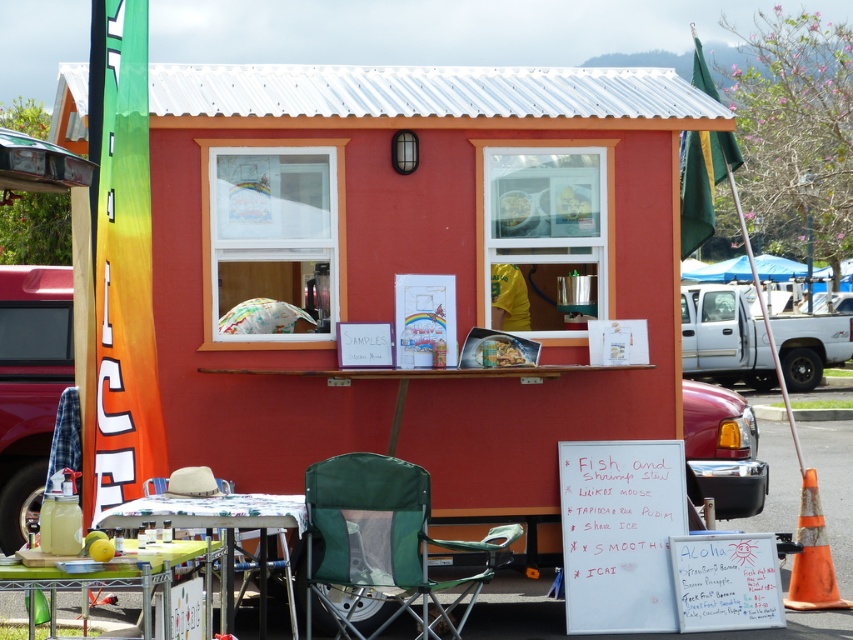
Question: Is the position of white plastic truck at center more distant than that of translucent plastic bag at upper center?

Choices:
 (A) yes
 (B) no

Answer: (A)

Question: Which point is closer to the camera taking this photo?

Choices:
 (A) (163, 580)
 (B) (367, 516)
 (C) (271, 506)

Answer: (A)

Question: Which object is positioned closest to the white plastic truck at center?

Choices:
 (A) translucent plastic bag at upper center
 (B) green fabric folding chair at lower center
 (C) green mesh table at center
 (D) green plastic table at lower left

Answer: (A)

Question: Which point appears farthest from the camera in this image?

Choices:
 (A) (502, 209)
 (B) (457, 544)
 (C) (102, 515)

Answer: (A)

Question: Is green fabric folding chair at lower center wider than green plastic table at lower left?

Choices:
 (A) yes
 (B) no

Answer: (A)

Question: Is green fabric folding chair at lower center above green plastic table at lower left?

Choices:
 (A) no
 (B) yes

Answer: (A)